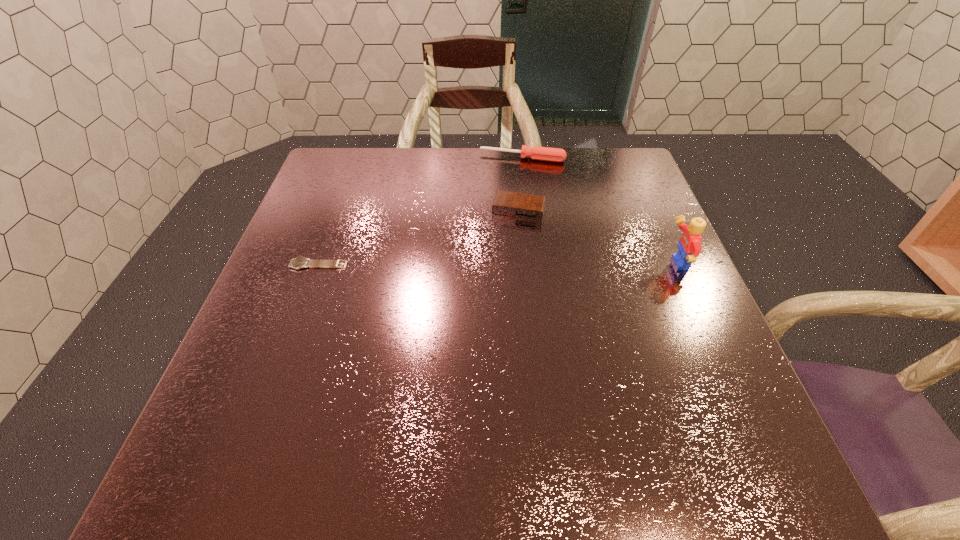
In order to click on free spot that satisfies the following two spatial constraints: 1. on the back side of the farthest object; 2. on the right side of the leftmost object in this screenshot , I will do `click(357, 158)`.

This screenshot has height=540, width=960. What are the coordinates of `free region that satisfies the following two spatial constraints: 1. on the front side of the farthest object; 2. on the face of the tallest object` in the screenshot? It's located at (536, 264).

In order to click on vacant space that satisfies the following two spatial constraints: 1. on the front side of the third nearest object; 2. on the face of the rightmost object in this screenshot , I will do tap(524, 264).